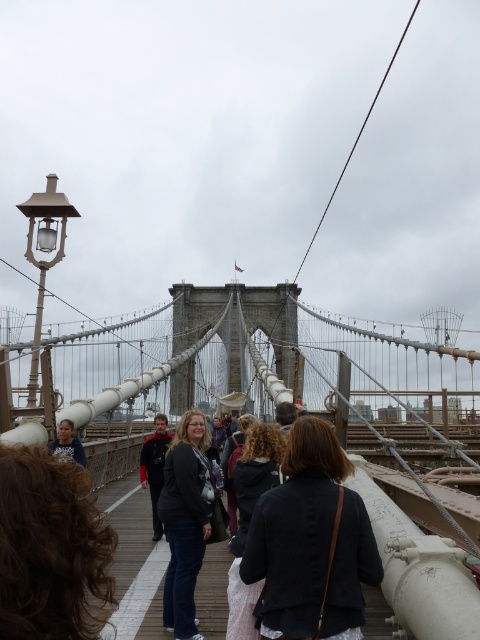
Please look at the image of the Brooklyn Bridge. There is a point marked at coordinates (49, 548). What is located at this point?

The point at coordinates (49, 548) marks dark brown curly hair at center.

You are a photographer standing on the Brooklyn Bridge and want to capture both the dark gray fabric jacket at center and the dark gray sweater at center in a single photo. What is the minimum distance you need to move backward to ensure both subjects are in frame?

The dark gray fabric jacket at center and dark gray sweater at center are 13.85 meters apart. To capture both in a single photo, you need to move backward until your camera can accommodate a distance of at least 13.85 meters between them. The exact distance to move depends on your camera lens and sensor size, but ensuring the frame can cover this span is essential.